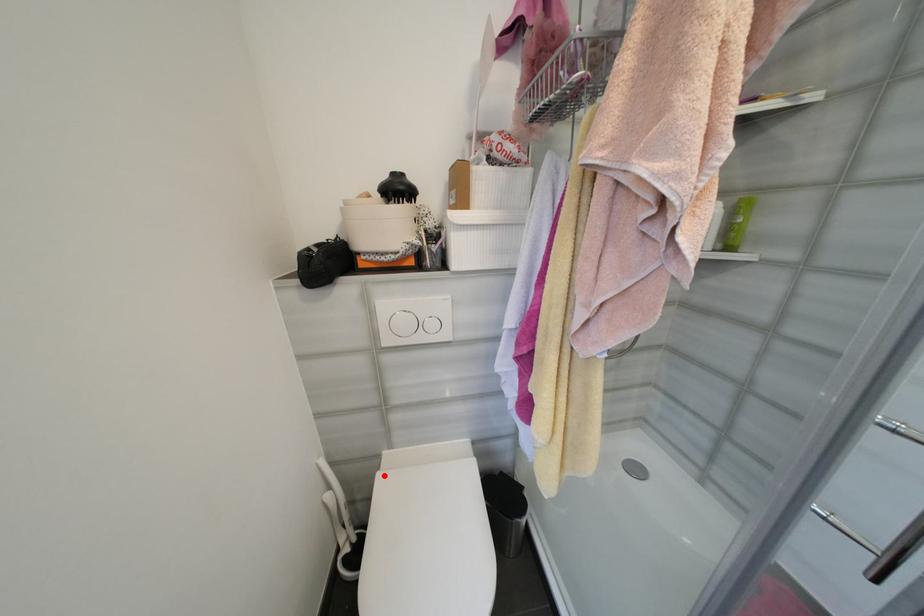
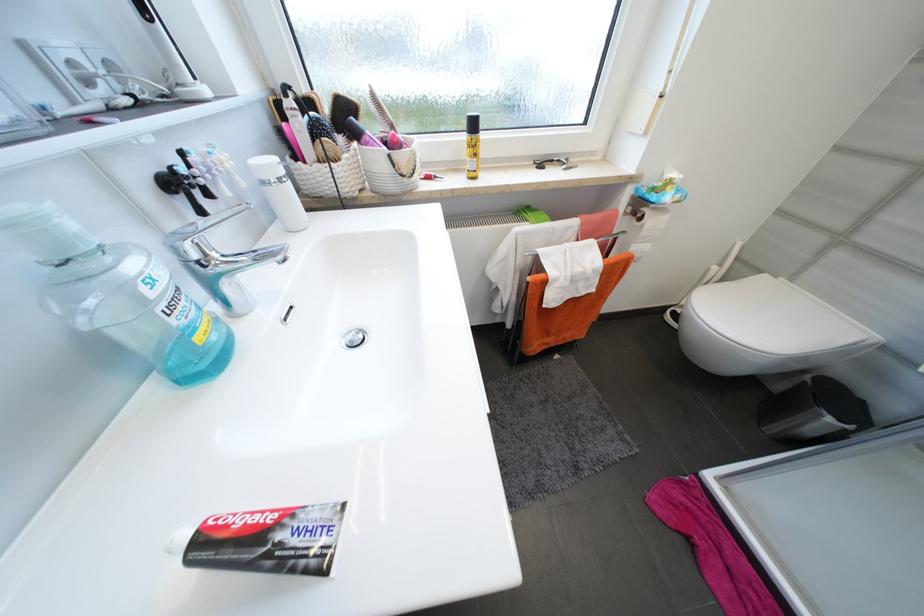
In the second image, find the point that corresponds to the highlighted location in the first image.

(771, 277)